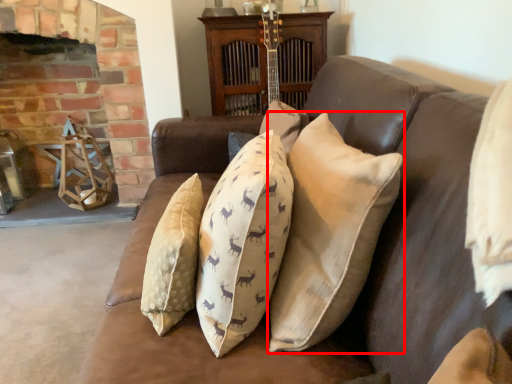
Question: From the image, what is the correct spatial relationship of pillow (annotated by the red box) in relation to fireplace?

Choices:
 (A) left
 (B) right

Answer: (B)